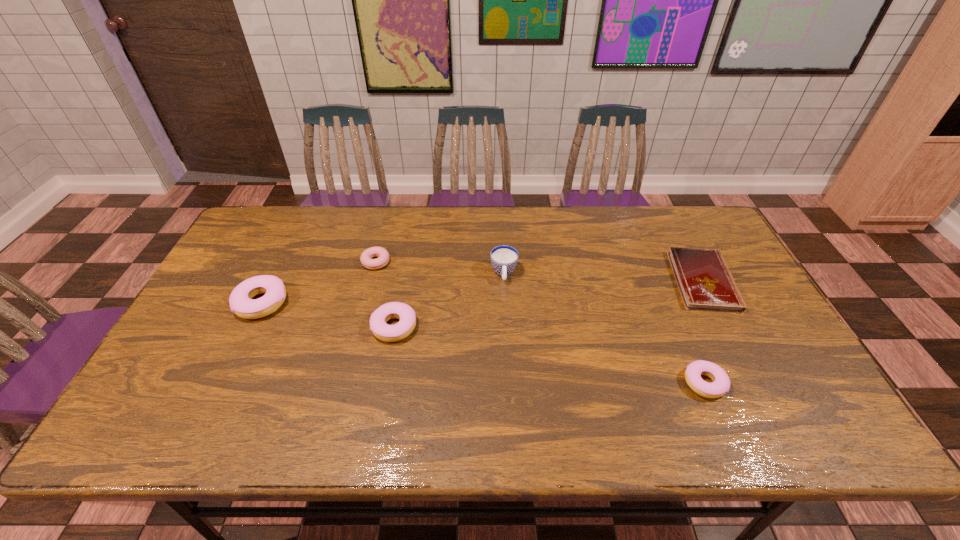
The height and width of the screenshot is (540, 960). Find the location of `free space located on the front of the third tallest object`. free space located on the front of the third tallest object is located at coordinates (384, 386).

The height and width of the screenshot is (540, 960). What are the coordinates of `free space located 0.400m on the back of the rightmost doughnut` in the screenshot? It's located at (652, 259).

Find the location of a particular element. Image resolution: width=960 pixels, height=540 pixels. vacant space situated 0.380m on the front of the farthest doughnut is located at coordinates (347, 379).

Locate an element on the screen. This screenshot has width=960, height=540. vacant area situated 0.200m on the left of the notebook is located at coordinates (606, 281).

The width and height of the screenshot is (960, 540). Identify the location of free space located on the side of the fourth object from left to right with the handle. (507, 328).

Locate an element on the screen. This screenshot has height=540, width=960. object situated at the near edge is located at coordinates (720, 386).

Where is `object that is at the left edge`? The image size is (960, 540). object that is at the left edge is located at coordinates (241, 303).

This screenshot has width=960, height=540. Find the location of `object that is positioned at the right edge`. object that is positioned at the right edge is located at coordinates (704, 280).

Find the location of a particular element. This screenshot has width=960, height=540. free space at the far edge is located at coordinates (482, 233).

Where is `vacant space at the near edge of the desktop`? vacant space at the near edge of the desktop is located at coordinates (523, 402).